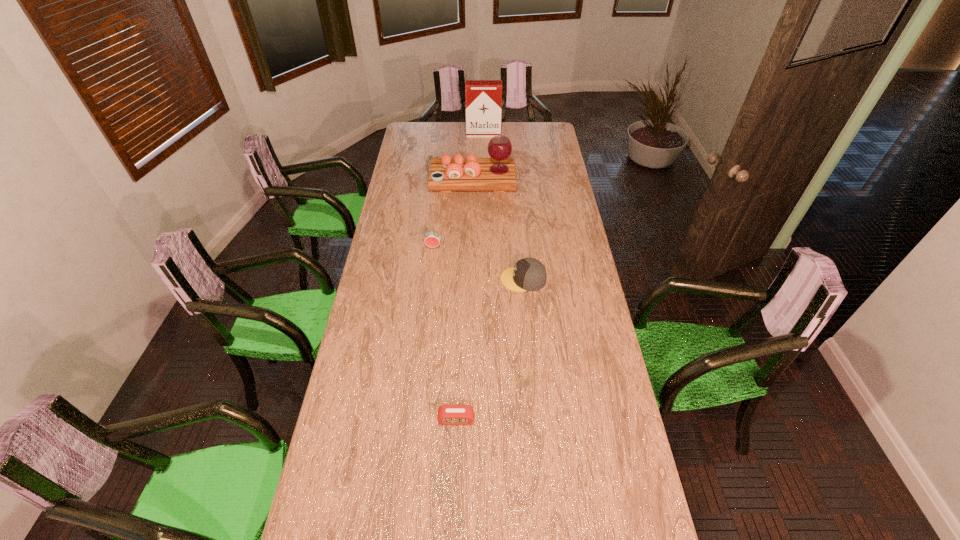
The image size is (960, 540). Identify the location of the farthest object. (483, 97).

Where is `cigarette_case`? cigarette_case is located at coordinates (483, 97).

At what (x,y) coordinates should I click in order to perform the action: click on the fourth shortest object. Please return your answer as a coordinate pair (x, y). The width and height of the screenshot is (960, 540). Looking at the image, I should click on (497, 174).

The width and height of the screenshot is (960, 540). I want to click on platter, so click(x=497, y=174).

Identify the location of the third farthest object. (432, 238).

Locate an element on the screen. The image size is (960, 540). the taller alarm clock is located at coordinates (432, 238).

Locate an element on the screen. The image size is (960, 540). the second nearest object is located at coordinates (528, 274).

Where is `cap`? cap is located at coordinates (528, 274).

Where is `the shorter alarm clock`? the shorter alarm clock is located at coordinates (447, 414).

Where is `the right alarm clock`? the right alarm clock is located at coordinates (447, 414).